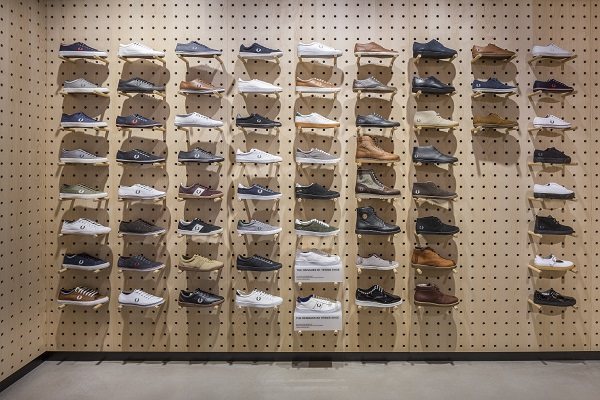
This screenshot has width=600, height=400. In order to click on bottom row of shoes in this screenshot , I will do `click(84, 296)`, `click(141, 296)`, `click(195, 298)`, `click(254, 300)`, `click(314, 304)`, `click(377, 297)`, `click(429, 299)`, `click(544, 296)`.